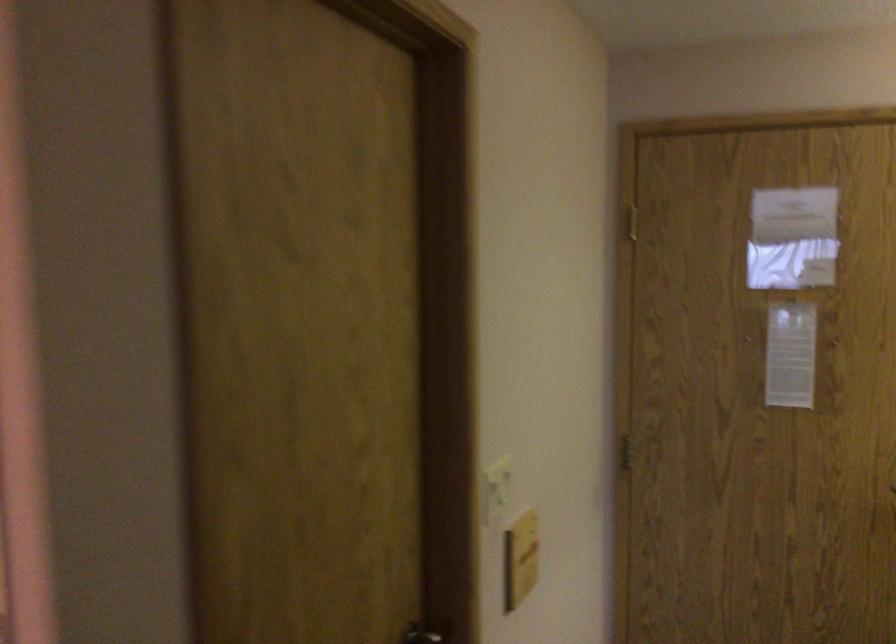
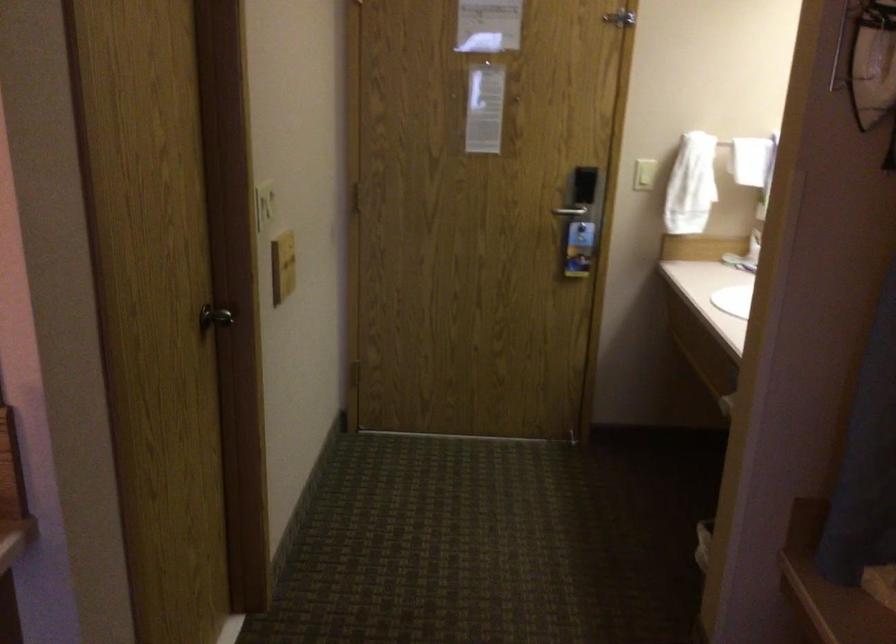
Question: The camera is either moving clockwise (left) or counter-clockwise (right) around the object. The first image is from the beginning of the video and the second image is from the end. Is the camera moving left or right when shooting the video?

Choices:
 (A) Left
 (B) Right

Answer: (A)